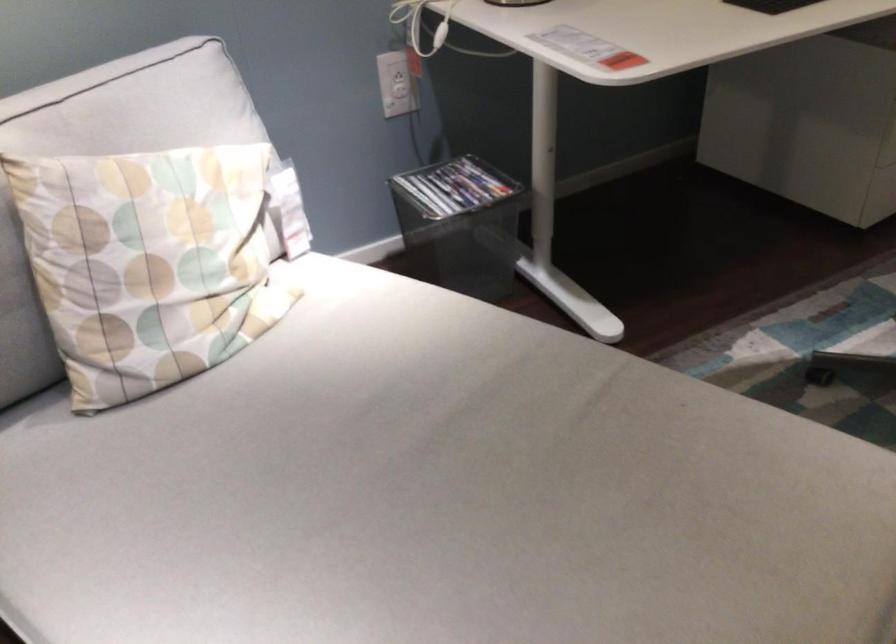
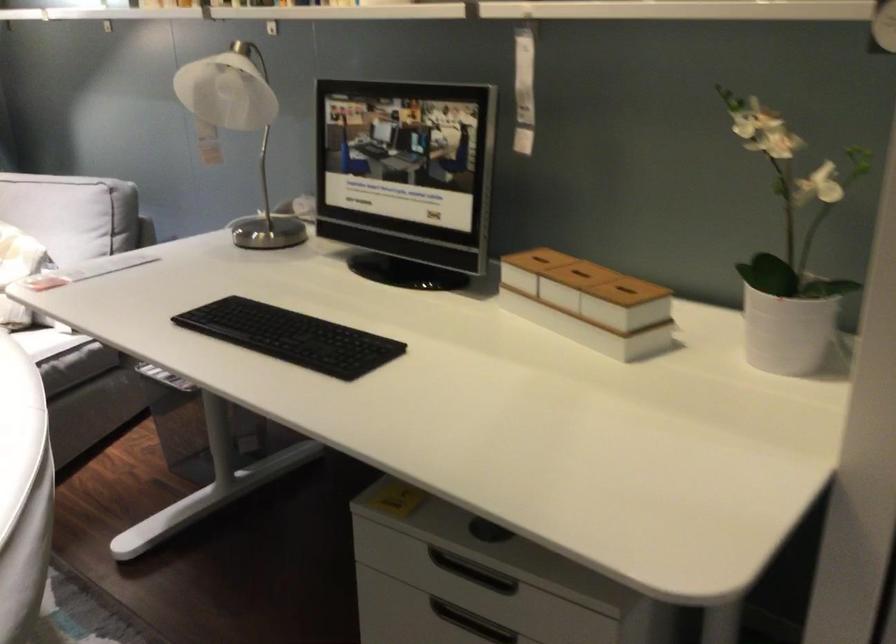
Question: I am providing you with two images of the same scene from different viewpoints. Which of the following objects are not visible in image2?

Choices:
 (A) white plant pot
 (B) organizer box lid
 (C) small storage bin
 (D) hanging chair sitting surface

Answer: (C)